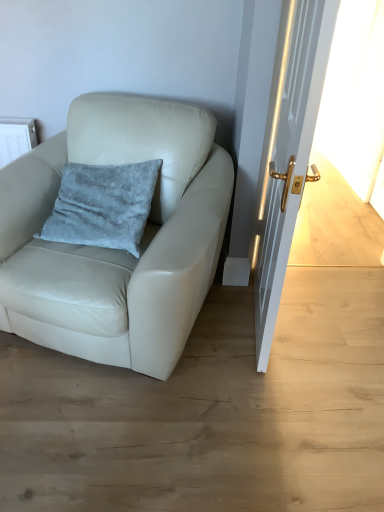
Question: Is white glossy door at right wider or thinner than white leather chair at left?

Choices:
 (A) thin
 (B) wide

Answer: (A)

Question: From the image's perspective, is white glossy door at right above or below white leather chair at left?

Choices:
 (A) above
 (B) below

Answer: (A)

Question: Based on their relative distances, which object is farther from the white leather chair at left?

Choices:
 (A) white glossy door at right
 (B) velvety blue pillow at center-left

Answer: (A)

Question: Which of these objects is positioned farthest from the white leather chair at left?

Choices:
 (A) velvety blue pillow at center-left
 (B) white glossy door at right

Answer: (B)